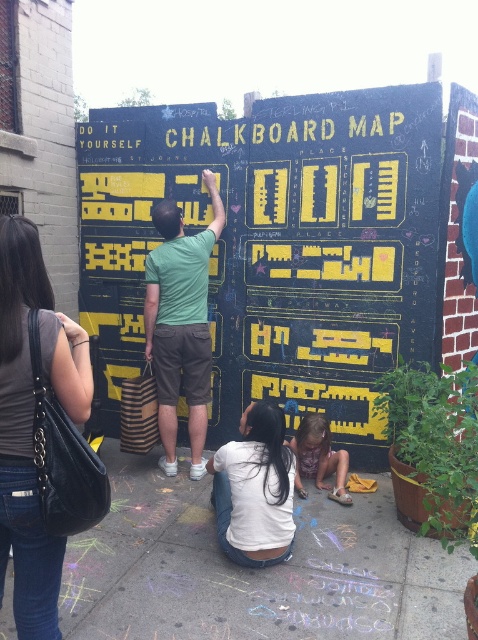
Question: Which object is the farthest from the chalk at lower center?

Choices:
 (A) matte purple dress at lower center
 (B) dark gray leather handbag at lower left
 (C) white cotton shirt at lower center

Answer: (B)

Question: Can you confirm if chalk at lower center is positioned above green matte shirt at center?

Choices:
 (A) yes
 (B) no

Answer: (B)

Question: Which object appears farthest from the camera in this image?

Choices:
 (A) green matte shirt at center
 (B) chalk at lower center

Answer: (A)

Question: Can you confirm if dark gray leather handbag at lower left is smaller than white cotton shirt at lower center?

Choices:
 (A) yes
 (B) no

Answer: (B)

Question: Which of the following is the farthest from the observer?

Choices:
 (A) green matte shirt at center
 (B) black chalkboard map at center
 (C) matte purple dress at lower center

Answer: (A)

Question: Is green matte shirt at center smaller than white cotton shirt at lower center?

Choices:
 (A) yes
 (B) no

Answer: (B)